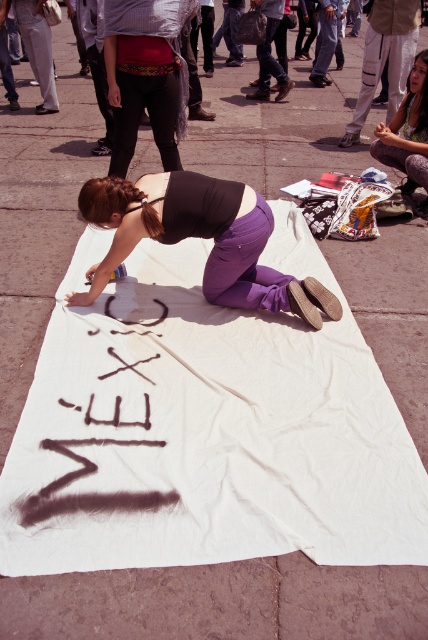
You are a photographer standing in the plaza and want to take a photo of the woman writing on the cloth. You notice two points in the scene labeled as point 1 and point 2. If point 1 is at coordinate point (125, 64) and point 2 is at coordinate point (121, 420), which point is closer to your camera?

Point 1 at coordinate point (125, 64) is closer to the camera than point 2 at coordinate point (121, 420) because the description states that point (125, 64) is further to the camera than point (121, 420).

You are standing in the plaza and want to find the woman writing on the cloth with the word Mexico. Which object at point (x=145, y=76) can help you locate her?

The matte red shirt at center is located at point (x=145, y=76), so you can look for that to locate the woman writing on the cloth with the word Mexico.

Looking at this image, you are a photographer positioned at the edge of the plaza. You want to capture a photo that includes both the matte red shirt at center and the spray paint sign at center without any obstruction. Given their positions, which object should you focus on first to ensure both are in frame?

The matte red shirt at center has a greater height compared to the spray paint sign at center. To ensure both are in frame, focus on the taller matte red shirt at center first, then adjust the camera angle to include the shorter spray paint sign at center.